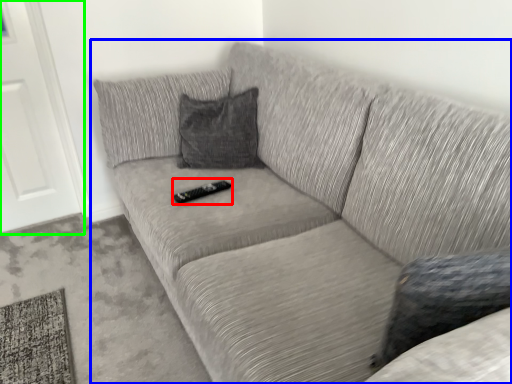
Question: Which object is the closest to the remote (highlighted by a red box)? Choose among these: studio couch (highlighted by a blue box) or door (highlighted by a green box).

Choices:
 (A) studio couch
 (B) door

Answer: (A)